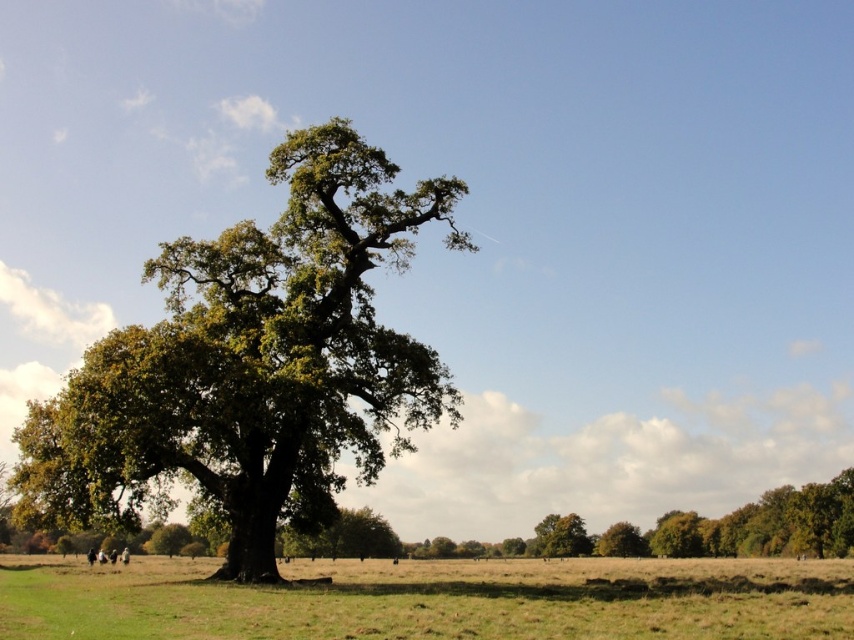
Question: Can you confirm if green leafy oak tree at left is wider than green grass at center?

Choices:
 (A) yes
 (B) no

Answer: (B)

Question: Can you confirm if green leafy oak tree at left is positioned to the right of green grass at center?

Choices:
 (A) yes
 (B) no

Answer: (B)

Question: Which of the following is the farthest from the observer?

Choices:
 (A) (132, 422)
 (B) (235, 598)

Answer: (A)

Question: Is green leafy oak tree at left further to camera compared to green grass at center?

Choices:
 (A) yes
 (B) no

Answer: (A)

Question: Which object appears farthest from the camera in this image?

Choices:
 (A) green grass at center
 (B) green leafy oak tree at left

Answer: (B)